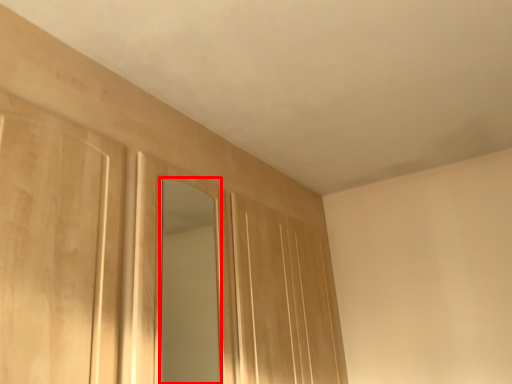
Question: From the image's perspective, where is mirror (annotated by the red box) located relative to door?

Choices:
 (A) below
 (B) above

Answer: (B)